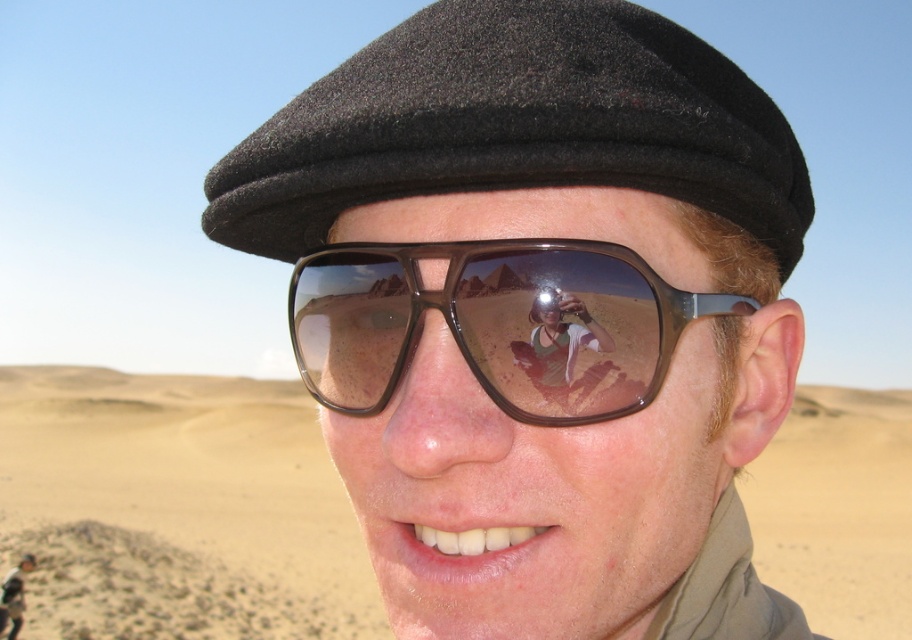
Question: Can you confirm if black woolen cap at upper center is smaller than brown plastic sunglasses at center?

Choices:
 (A) yes
 (B) no

Answer: (B)

Question: Among these points, which one is farthest from the camera?

Choices:
 (A) 494,536
 (B) 841,406
 (C) 448,129

Answer: (B)

Question: Among these objects, which one is nearest to the camera?

Choices:
 (A) desert sand at lower left
 (B) matte black cap at center

Answer: (B)

Question: Which of the following is the farthest from the observer?

Choices:
 (A) desert sand at lower left
 (B) black woolen cap at upper center
 (C) brown plastic sunglasses at center

Answer: (A)

Question: Does desert sand at lower left have a larger size compared to brown plastic sunglasses at center?

Choices:
 (A) yes
 (B) no

Answer: (A)

Question: Is the position of desert sand at lower left less distant than that of brown plastic sunglasses at center?

Choices:
 (A) no
 (B) yes

Answer: (A)